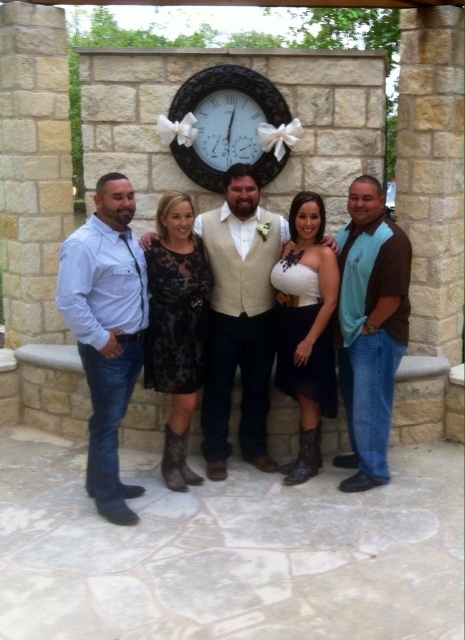
Question: Among these objects, which one is nearest to the camera?

Choices:
 (A) matte white dress at center
 (B) black lace dress at center
 (C) brown/tan vest at right
 (D) white satin dress at center

Answer: (A)

Question: Does light blue denim jeans at left have a smaller size compared to white satin dress at center?

Choices:
 (A) no
 (B) yes

Answer: (A)

Question: In this image, where is white satin dress at center located relative to black wooden clock at center?

Choices:
 (A) left
 (B) right

Answer: (B)

Question: Which object is the closest to the beige textured vest at center?

Choices:
 (A) white satin dress at center
 (B) black painted wood clock at center
 (C) black wooden clock at center
 (D) matte white dress at center

Answer: (D)

Question: Which of the following is the closest to the observer?

Choices:
 (A) (247, 86)
 (B) (210, 352)
 (C) (172, 202)
 (D) (160, 225)

Answer: (C)

Question: Does brown/tan vest at right lie in front of black lace dress at center?

Choices:
 (A) yes
 (B) no

Answer: (A)